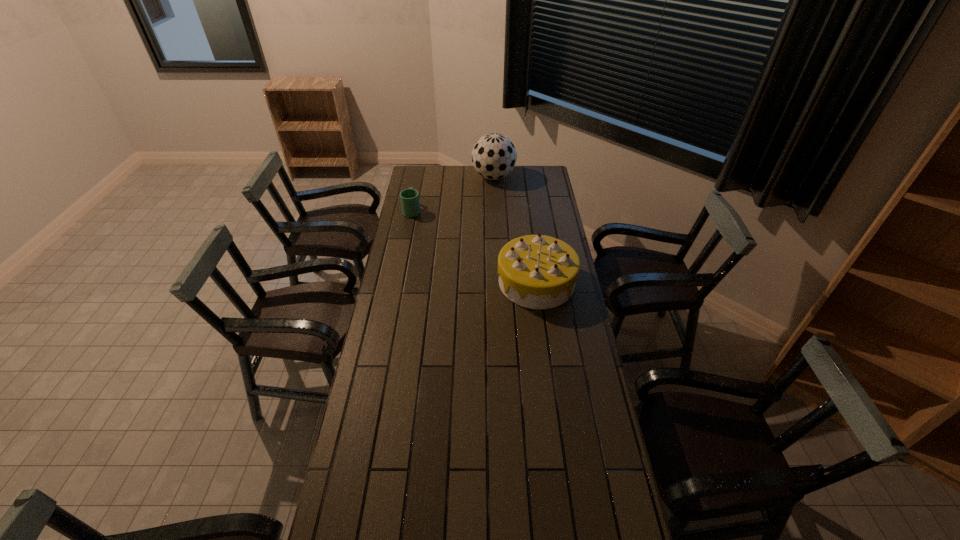
You are a GUI agent. You are given a task and a screenshot of the screen. Output one action in this format:
    pyautogui.click(x=<x>, y=<y>)
    Task: Click on the vacant space located on the side of the leftmost object with the handle
    This screenshot has height=540, width=960.
    Given the screenshot: What is the action you would take?
    pyautogui.click(x=420, y=172)

You are a GUI agent. You are given a task and a screenshot of the screen. Output one action in this format:
    pyautogui.click(x=<x>, y=<y>)
    Task: Click on the object that is at the far edge
    The width and height of the screenshot is (960, 540).
    Given the screenshot: What is the action you would take?
    pyautogui.click(x=494, y=156)

The width and height of the screenshot is (960, 540). I want to click on object situated at the left edge, so click(x=409, y=197).

Where is `object that is at the right edge`? The height and width of the screenshot is (540, 960). object that is at the right edge is located at coordinates (535, 271).

This screenshot has height=540, width=960. I want to click on vacant region at the far edge, so click(x=441, y=177).

In the image, there is a desktop. Identify the location of free space at the left edge. This screenshot has height=540, width=960. (356, 528).

In the image, there is a desktop. At what (x,y) coordinates should I click in order to perform the action: click on vacant space at the right edge. Please return your answer as a coordinate pair (x, y). This screenshot has width=960, height=540. Looking at the image, I should click on (590, 526).

This screenshot has width=960, height=540. I want to click on free region at the far right corner of the desktop, so click(x=531, y=181).

You are a GUI agent. You are given a task and a screenshot of the screen. Output one action in this format:
    pyautogui.click(x=<x>, y=<y>)
    Task: Click on the free space between the second tallest object and the leftmost object
    This screenshot has width=960, height=540.
    Given the screenshot: What is the action you would take?
    pyautogui.click(x=474, y=246)

Image resolution: width=960 pixels, height=540 pixels. In order to click on vacant space that is in between the nearest object and the shortest object in this screenshot , I will do `click(474, 246)`.